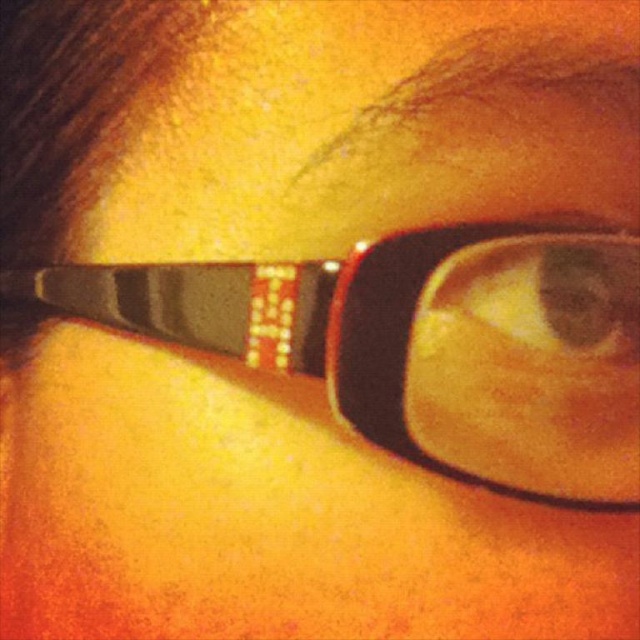
Is matte black glasses at center shorter than matte plastic eye at center?

No, matte black glasses at center is not shorter than matte plastic eye at center.

Which is below, matte black glasses at center or matte plastic eye at center?

matte black glasses at center is below.

Measure the distance between matte black glasses at center and camera.

9.05 inches

At what (x,y) coordinates should I click in order to perform the action: click on matte black glasses at center. Please return your answer as a coordinate pair (x, y). This screenshot has height=640, width=640. Looking at the image, I should click on (422, 342).